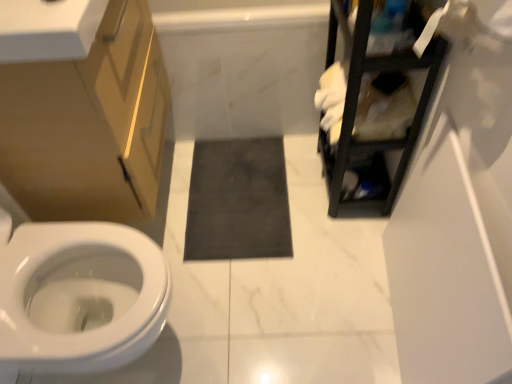
Where is `black metal shelving unit at upper right`? This screenshot has width=512, height=384. black metal shelving unit at upper right is located at coordinates (359, 112).

What is the approximate width of matte gold cabinet at left?

matte gold cabinet at left is 15.42 inches wide.

What do you see at coordinates (48, 29) in the screenshot? I see `white glossy countertop at upper left` at bounding box center [48, 29].

You are a GUI agent. You are given a task and a screenshot of the screen. Output one action in this format:
    pyautogui.click(x=<x>, y=<y>)
    Task: Click on the black metal shelving unit at upper right
    
    Given the screenshot: What is the action you would take?
    pyautogui.click(x=359, y=112)

Between white glossy countertop at upper left and black metal shelving unit at upper right, which one appears on the right side from the viewer's perspective?

black metal shelving unit at upper right is more to the right.

Could you tell me if white glossy countertop at upper left is facing black metal shelving unit at upper right?

No.

Between white glossy countertop at upper left and black metal shelving unit at upper right, which one has larger size?

black metal shelving unit at upper right.

Can you confirm if white marble bath at center is taller than white glossy countertop at upper left?

Yes, white marble bath at center is taller than white glossy countertop at upper left.

Could you tell me if white marble bath at center is turned towards white glossy countertop at upper left?

No, white marble bath at center is not facing towards white glossy countertop at upper left.

Considering their positions, is white marble bath at center located in front of or behind white glossy countertop at upper left?

Visually, white marble bath at center is located behind white glossy countertop at upper left.

Locate an element on the screen. This screenshot has width=512, height=384. bath that appears below the white glossy countertop at upper left (from a real-world perspective) is located at coordinates (242, 65).

Would you say black metal shelving unit at upper right is to the left or to the right of dark gray matte bath mat at center in the picture?

black metal shelving unit at upper right is positioned on dark gray matte bath mat at center's right side.

Does black metal shelving unit at upper right lie in front of dark gray matte bath mat at center?

Yes, it is.

From a real-world perspective, is black metal shelving unit at upper right below dark gray matte bath mat at center?

No, from a real-world perspective, black metal shelving unit at upper right is not beneath dark gray matte bath mat at center.

Is dark gray matte bath mat at center smaller than black metal shelving unit at upper right?

Yes.

In the scene shown: Is dark gray matte bath mat at center positioned in front of black metal shelving unit at upper right?

No, it is not.

From the image's perspective, between dark gray matte bath mat at center and black metal shelving unit at upper right, who is located below?

dark gray matte bath mat at center, from the image's perspective.

Is dark gray matte bath mat at center located outside black metal shelving unit at upper right?

Yes.

From a real-world perspective, which is physically below, black metal shelving unit at upper right or white marble bath at center?

white marble bath at center.

Based on their positions, is black metal shelving unit at upper right located to the left or right of white marble bath at center?

Clearly, black metal shelving unit at upper right is on the right of white marble bath at center in the image.

Considering their positions, is black metal shelving unit at upper right located in front of or behind white marble bath at center?

black metal shelving unit at upper right is positioned closer to the viewer than white marble bath at center.

From the image's perspective, would you say white glossy countertop at upper left is shown under white marble bath at center?

Correct, white glossy countertop at upper left appears lower than white marble bath at center in the image.

Is white glossy countertop at upper left oriented towards white marble bath at center?

No, white glossy countertop at upper left is not aimed at white marble bath at center.

Does white glossy countertop at upper left have a lesser width compared to white marble bath at center?

No.

Based on the photo, are white glossy countertop at upper left and white marble bath at center far apart?

No, white glossy countertop at upper left is in close proximity to white marble bath at center.

Is black metal shelving unit at upper right surrounding matte gold cabinet at left?

No, matte gold cabinet at left is not inside black metal shelving unit at upper right.

Which is more to the right, black metal shelving unit at upper right or matte gold cabinet at left?

black metal shelving unit at upper right.

Where is `counter top that appears above the black metal shelving unit at upper right (from the image's perspective)`? This screenshot has width=512, height=384. counter top that appears above the black metal shelving unit at upper right (from the image's perspective) is located at coordinates (48, 29).

Identify the location of counter top in front of the white marble bath at center. Image resolution: width=512 pixels, height=384 pixels. (48, 29).

Looking at the image, which one is located closer to matte gold cabinet at left, black metal shelving unit at upper right or white glossy countertop at upper left?

white glossy countertop at upper left is positioned closer to the anchor matte gold cabinet at left.

Consider the image. Based on their spatial positions, is black metal shelving unit at upper right or white marble bath at center further from matte gold cabinet at left?

Based on the image, black metal shelving unit at upper right appears to be further to matte gold cabinet at left.

Considering their positions, is white glossy countertop at upper left positioned closer to white marble bath at center than dark gray matte bath mat at center?

Based on the image, dark gray matte bath mat at center appears to be nearer to white marble bath at center.

Based on their spatial positions, is white glossy countertop at upper left or black metal shelving unit at upper right closer to dark gray matte bath mat at center?

Based on the image, black metal shelving unit at upper right appears to be nearer to dark gray matte bath mat at center.

When comparing their distances from white marble bath at center, does matte gold cabinet at left or dark gray matte bath mat at center seem further?

matte gold cabinet at left is further to white marble bath at center.

When comparing their distances from matte gold cabinet at left, does white glossy countertop at upper left or white marble bath at center seem closer?

white glossy countertop at upper left is positioned closer to the anchor matte gold cabinet at left.

Consider the image. Estimate the real-world distances between objects in this image. Which object is further from black metal shelving unit at upper right, matte gold cabinet at left or white marble bath at center?

Among the two, matte gold cabinet at left is located further to black metal shelving unit at upper right.

Looking at the image, which one is located closer to white marble bath at center, black metal shelving unit at upper right or dark gray matte bath mat at center?

dark gray matte bath mat at center is positioned closer to the anchor white marble bath at center.

Locate an element on the screen. The height and width of the screenshot is (384, 512). bath situated between white glossy countertop at upper left and black metal shelving unit at upper right from left to right is located at coordinates (242, 65).

The image size is (512, 384). Find the location of `bathroom cabinet between white glossy countertop at upper left and dark gray matte bath mat at center along the z-axis`. bathroom cabinet between white glossy countertop at upper left and dark gray matte bath mat at center along the z-axis is located at coordinates tap(89, 125).

Identify the location of counter top between matte gold cabinet at left and black metal shelving unit at upper right from left to right. The width and height of the screenshot is (512, 384). (48, 29).

This screenshot has height=384, width=512. In order to click on bath between black metal shelving unit at upper right and dark gray matte bath mat at center in the front-back direction in this screenshot , I will do `click(242, 65)`.